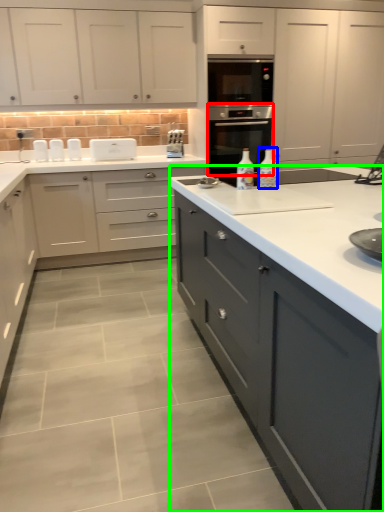
Question: Which object is positioned farthest from home appliance (highlighted by a red box)? Select from bottle (highlighted by a blue box) and cabinetry (highlighted by a green box).

Choices:
 (A) bottle
 (B) cabinetry

Answer: (B)